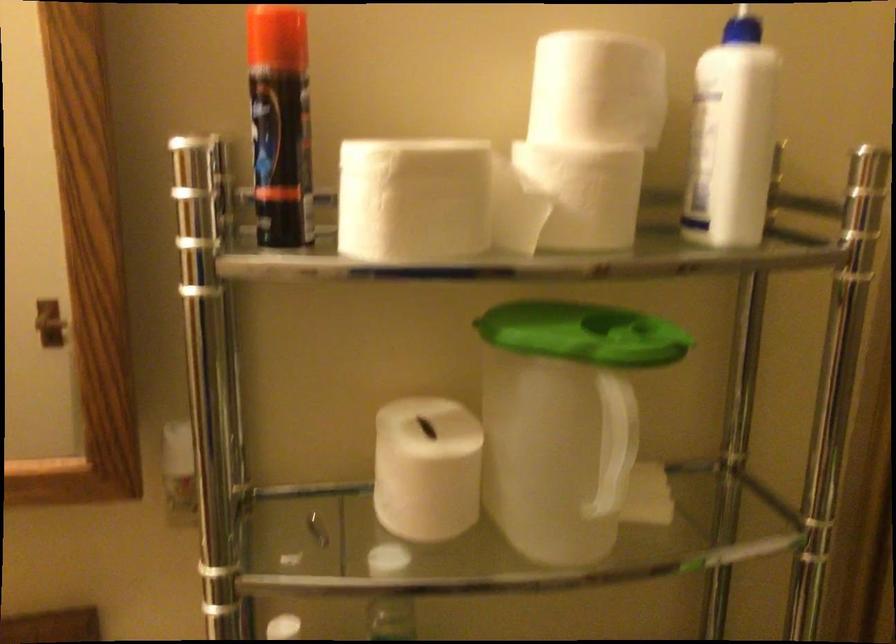
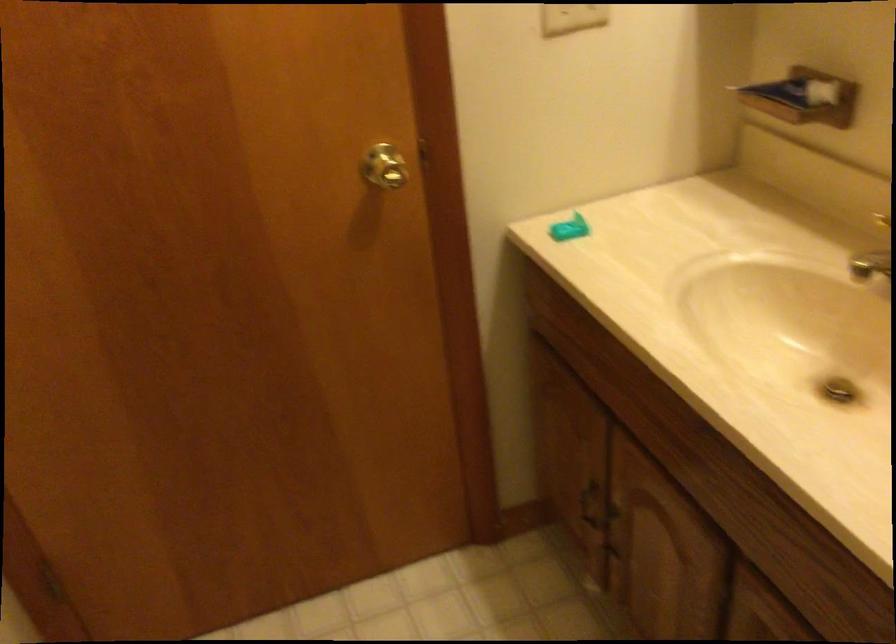
Based on the continuous images, in which direction is the camera rotating?

The rotation direction of the camera is left-down.